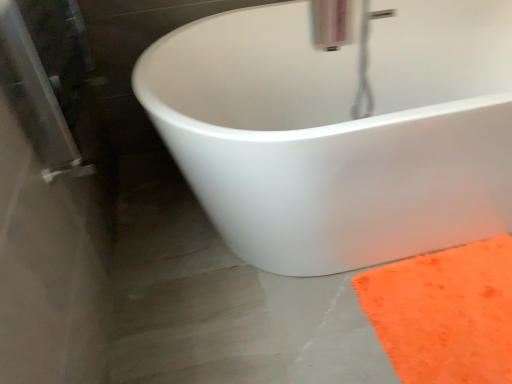
Question: From the image's perspective, is metallic silver faucet at upper center located above or below white matte bathtub at center?

Choices:
 (A) above
 (B) below

Answer: (A)

Question: Is metallic silver faucet at upper center in front of or behind white matte bathtub at center in the image?

Choices:
 (A) front
 (B) behind

Answer: (B)

Question: Which object is the closest to the white matte bathtub at center?

Choices:
 (A) metallic silver faucet at upper center
 (B) orange fuzzy rug at lower right

Answer: (B)

Question: Considering the real-world distances, which object is farthest from the white matte bathtub at center?

Choices:
 (A) metallic silver faucet at upper center
 (B) orange fuzzy rug at lower right

Answer: (A)